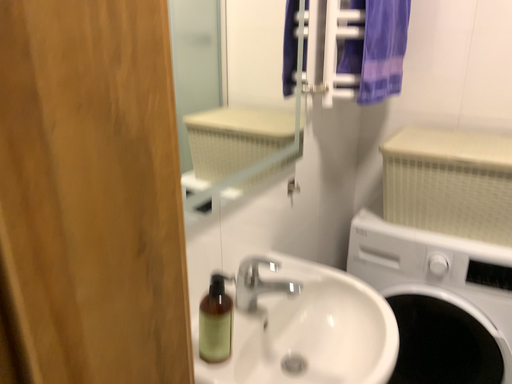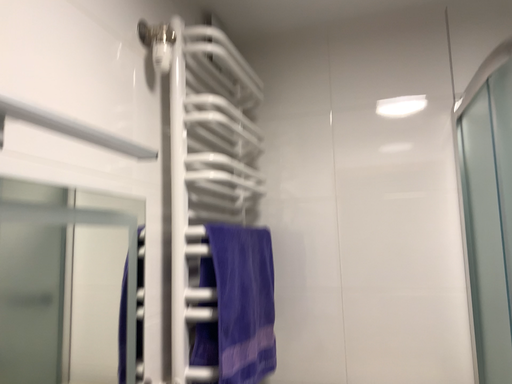
Question: Which way did the camera rotate in the video?

Choices:
 (A) rotated right
 (B) rotated left

Answer: (A)